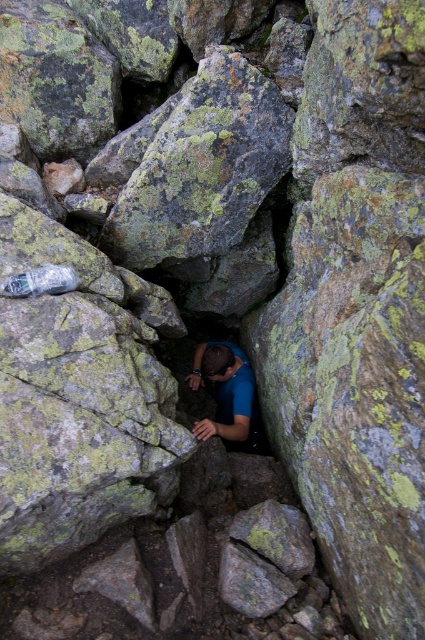
Is blue fabric at center above transparent plastic bottle at lower left?

No, blue fabric at center is not above transparent plastic bottle at lower left.

Which is in front, point (255, 403) or point (22, 284)?

Point (22, 284) is more forward.

The height and width of the screenshot is (640, 425). What are the coordinates of `blue fabric at center` in the screenshot? It's located at (229, 397).